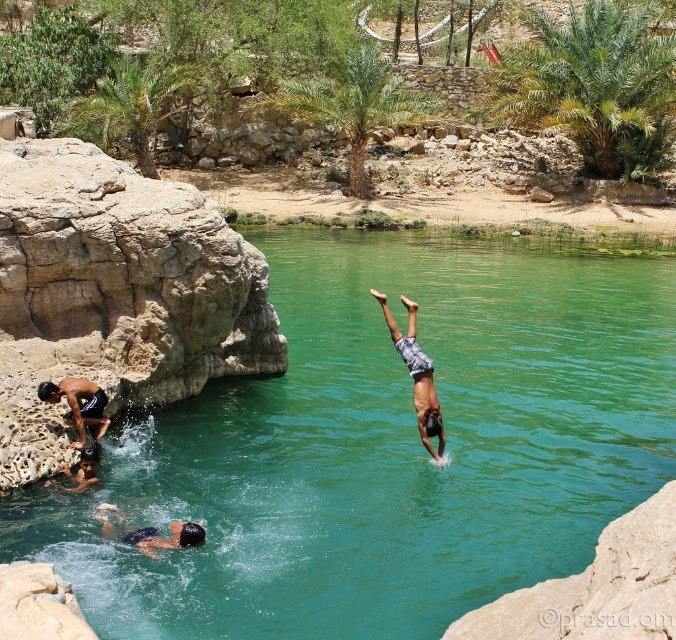
Question: Is green smooth water at center below plaid shorts at center?

Choices:
 (A) yes
 (B) no

Answer: (A)

Question: Which object appears closest to the camera in this image?

Choices:
 (A) dark blue shorts at left
 (B) green smooth water at center

Answer: (B)

Question: Among these objects, which one is nearest to the camera?

Choices:
 (A) green smooth water at center
 (B) dark blue swim trunks at lower left
 (C) plaid shorts at center
 (D) dark blue shorts at left

Answer: (A)

Question: Is dark blue swimwear at lower left below dark blue swim trunks at lower left?

Choices:
 (A) no
 (B) yes

Answer: (B)

Question: Is green smooth water at center smaller than dark blue swim trunks at lower left?

Choices:
 (A) no
 (B) yes

Answer: (A)

Question: Estimate the real-world distances between objects in this image. Which object is farther from the dark blue swim trunks at lower left?

Choices:
 (A) plaid shorts at center
 (B) dark blue shorts at left
 (C) green smooth water at center
 (D) dark blue swimwear at lower left

Answer: (A)